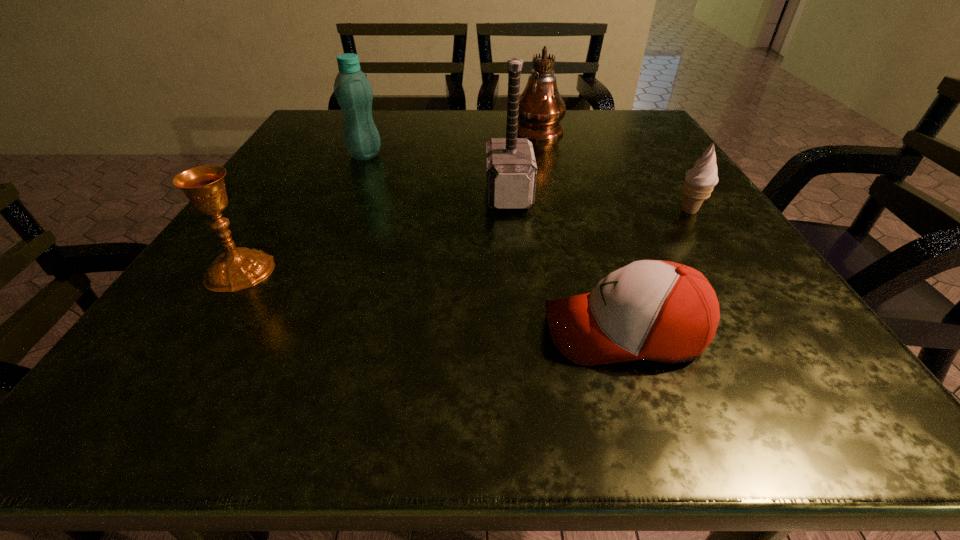
At what (x,y) coordinates should I click in order to perform the action: click on baseball cap. Please return your answer as a coordinate pair (x, y). The image size is (960, 540). Looking at the image, I should click on (663, 311).

The image size is (960, 540). I want to click on vacant space located on the right of the oil lamp, so click(608, 129).

The height and width of the screenshot is (540, 960). What are the coordinates of `blank area located 0.390m for striking with the head of the fifth shortest object` in the screenshot? It's located at (278, 195).

Identify the location of vacant space located for striking with the head of the fifth shortest object. (412, 195).

Locate an element on the screen. This screenshot has height=540, width=960. vacant area situated for striking with the head of the fifth shortest object is located at coordinates (310, 195).

This screenshot has height=540, width=960. In order to click on vacant space located 0.080m at the front cap of the second farthest object in this screenshot , I will do `click(353, 181)`.

The width and height of the screenshot is (960, 540). In order to click on free location located 0.280m on the back of the fifth farthest object in this screenshot , I will do `click(305, 167)`.

Find the location of a particular element. free region located 0.260m on the front-facing side of the rightmost object is located at coordinates (530, 211).

The image size is (960, 540). What are the coordinates of `vacant area situated 0.180m on the front-facing side of the rightmost object` in the screenshot? It's located at (574, 211).

Identify the location of vacant space located on the front-facing side of the rightmost object. (463, 211).